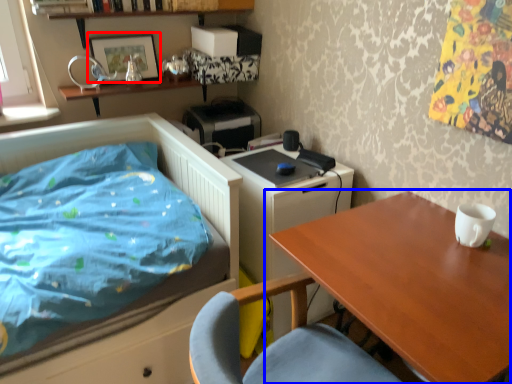
Question: Which point is further to the camera, picture frame (highlighted by a red box) or table (highlighted by a blue box)?

Choices:
 (A) picture frame
 (B) table

Answer: (A)